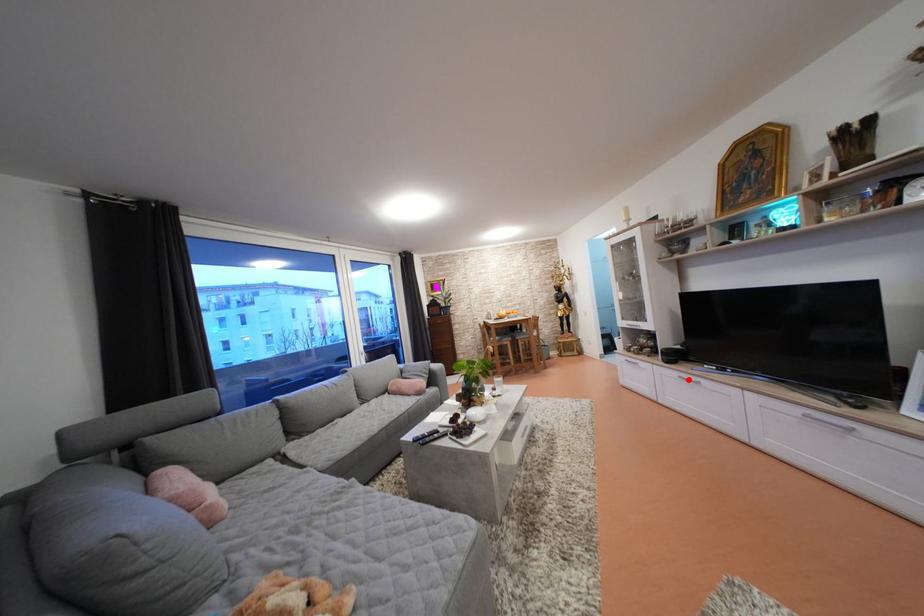
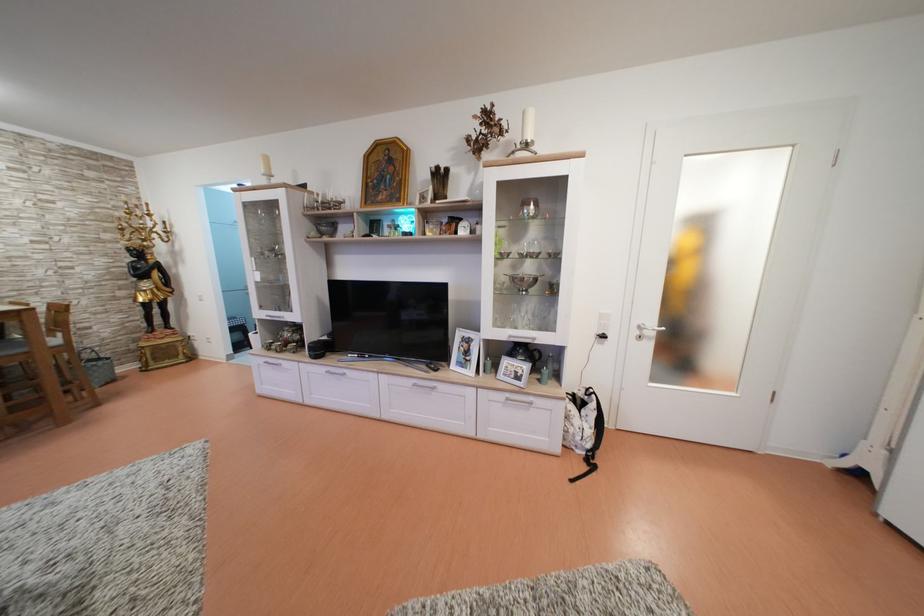
Question: I am providing you with two images of the same scene from different viewpoints. Image1 has a red point marked. In image2, the corresponding 3D location appears at what relative position? Reply with the corresponding letter.

Choices:
 (A) Closer
 (B) Farther

Answer: (B)